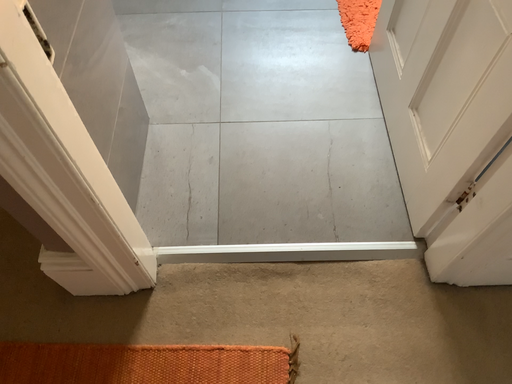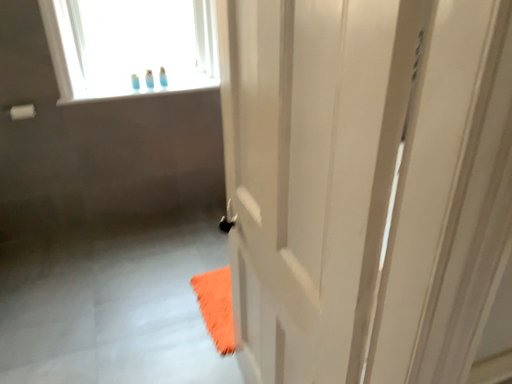
Question: How did the camera likely rotate when shooting the video?

Choices:
 (A) rotated downward
 (B) rotated upward

Answer: (B)